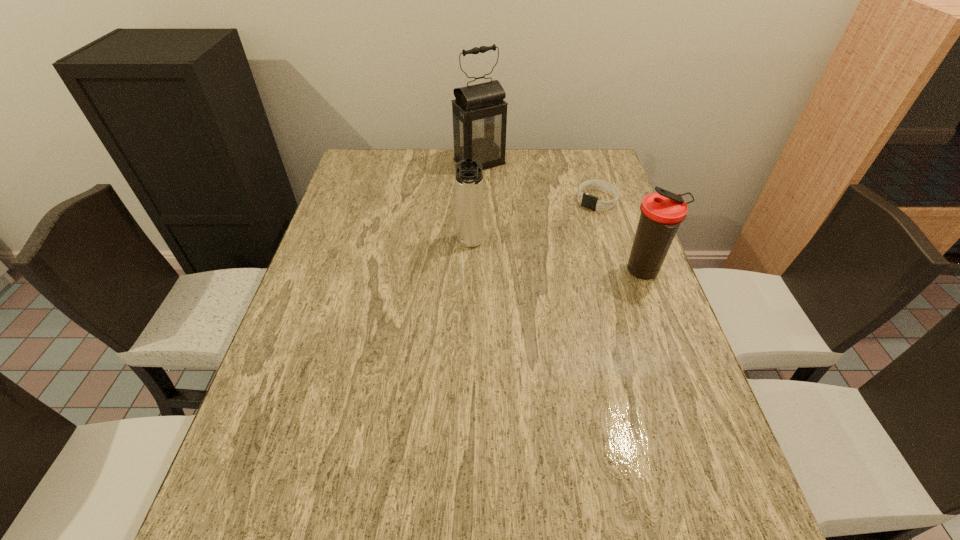
Find the location of `the left thermos bottle`. the left thermos bottle is located at coordinates (469, 176).

You are a GUI agent. You are given a task and a screenshot of the screen. Output one action in this format:
    pyautogui.click(x=<x>, y=<y>)
    Task: Click on the right thermos bottle
    
    Given the screenshot: What is the action you would take?
    pyautogui.click(x=661, y=213)

I want to click on the third nearest object, so click(591, 202).

Find the location of a particular element. This screenshot has height=540, width=960. wristband is located at coordinates (591, 202).

The height and width of the screenshot is (540, 960). What are the coordinates of `lantern` in the screenshot? It's located at (479, 112).

This screenshot has width=960, height=540. I want to click on the tallest object, so click(479, 112).

In order to click on vacant area located 0.280m on the handle side of the left thermos bottle in this screenshot , I will do `click(468, 342)`.

Locate an element on the screen. free space located 0.230m on the back of the right thermos bottle is located at coordinates (619, 207).

In order to click on free region located on the outer surface of the wristband in this screenshot , I will do `click(557, 239)`.

Locate an element on the screen. This screenshot has width=960, height=540. free spot located 0.150m on the outer surface of the wristband is located at coordinates (563, 234).